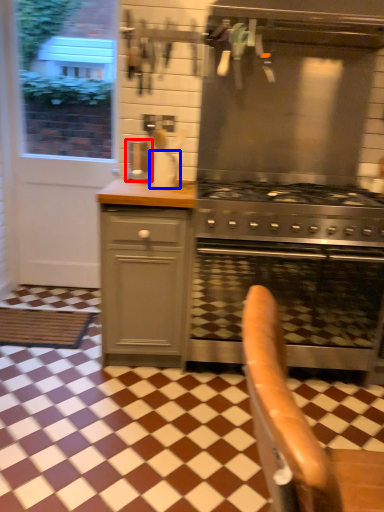
Question: Which object is further to the camera taking this photo, coffee machine (highlighted by a red box) or kitchen appliance (highlighted by a blue box)?

Choices:
 (A) coffee machine
 (B) kitchen appliance

Answer: (A)